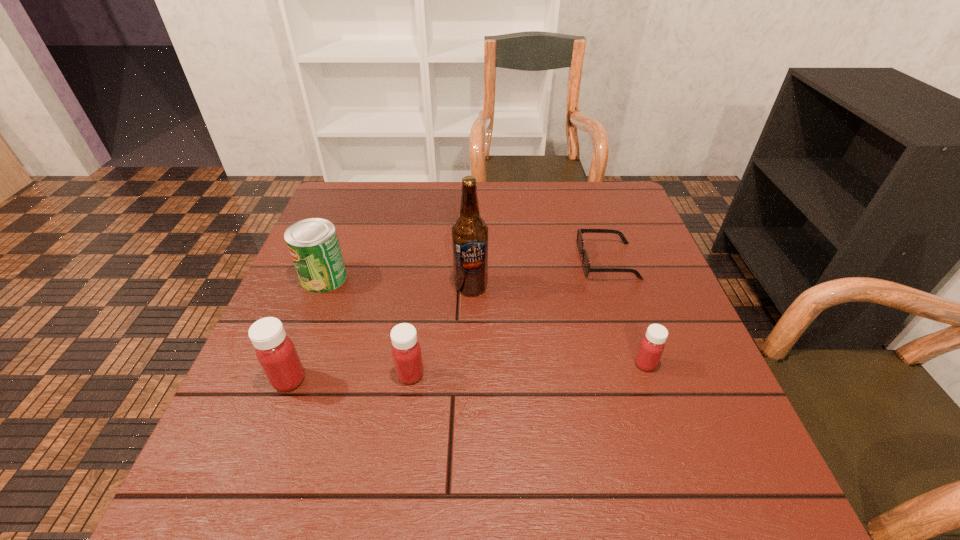
The width and height of the screenshot is (960, 540). Find the location of `vacant region located on the left of the second medicine from right to left`. vacant region located on the left of the second medicine from right to left is located at coordinates (336, 374).

At what (x,y) coordinates should I click in order to perform the action: click on vacant space located 0.100m on the left of the rightmost medicine. Please return your answer as a coordinate pair (x, y). The width and height of the screenshot is (960, 540). Looking at the image, I should click on (585, 364).

Locate an element on the screen. Image resolution: width=960 pixels, height=540 pixels. vacant space situated on the back of the can is located at coordinates (351, 207).

Locate an element on the screen. The image size is (960, 540). free space located 0.060m on the label of the third object from right to left is located at coordinates (470, 316).

Where is `vacant space positioned 0.060m on the front-facing side of the shortest object`? The image size is (960, 540). vacant space positioned 0.060m on the front-facing side of the shortest object is located at coordinates (555, 261).

This screenshot has height=540, width=960. I want to click on vacant space positioned 0.190m on the front-facing side of the shortest object, so pyautogui.click(x=504, y=261).

In order to click on free space located on the front-facing side of the shortest object in this screenshot , I will do coord(469,261).

Image resolution: width=960 pixels, height=540 pixels. In order to click on medicine that is at the left edge in this screenshot , I will do `click(275, 351)`.

I want to click on can positioned at the left edge, so click(313, 244).

Image resolution: width=960 pixels, height=540 pixels. I want to click on medicine present at the right edge, so click(652, 345).